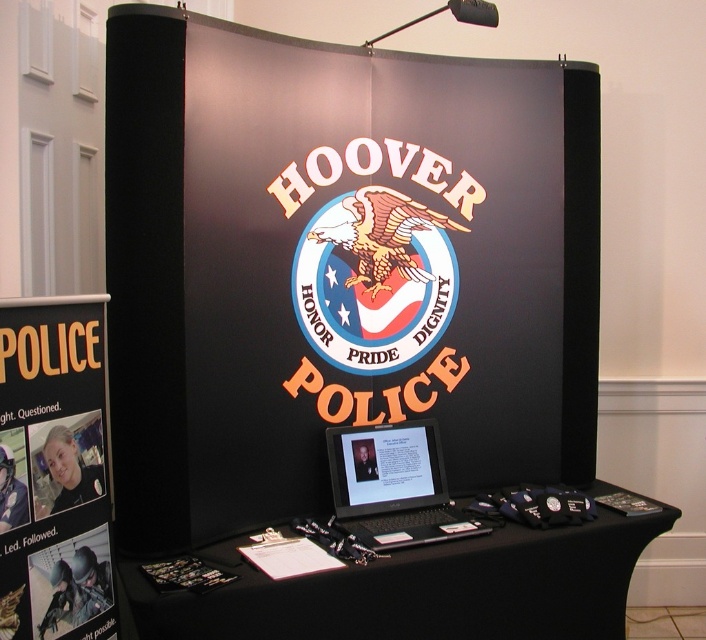
Question: Observing the image, what is the correct spatial positioning of black fabric table at lower center in reference to golden metallic eagle at center?

Choices:
 (A) right
 (B) left

Answer: (A)

Question: Does black paper poster at left appear on the left side of golden metallic eagle at center?

Choices:
 (A) yes
 (B) no

Answer: (A)

Question: Is black plastic laptop at center to the right of golden metallic eagle at center from the viewer's perspective?

Choices:
 (A) yes
 (B) no

Answer: (A)

Question: Which object is closer to the camera taking this photo?

Choices:
 (A) black plastic laptop at center
 (B) golden metallic eagle at center
 (C) black fabric table at lower center
 (D) black matte board at center

Answer: (C)

Question: Which object appears farthest from the camera in this image?

Choices:
 (A) golden metallic eagle at center
 (B) black paper poster at left
 (C) black matte board at center

Answer: (A)

Question: Which object is the closest to the black fabric table at lower center?

Choices:
 (A) golden metallic eagle at center
 (B) black plastic laptop at center
 (C) black paper poster at left

Answer: (B)